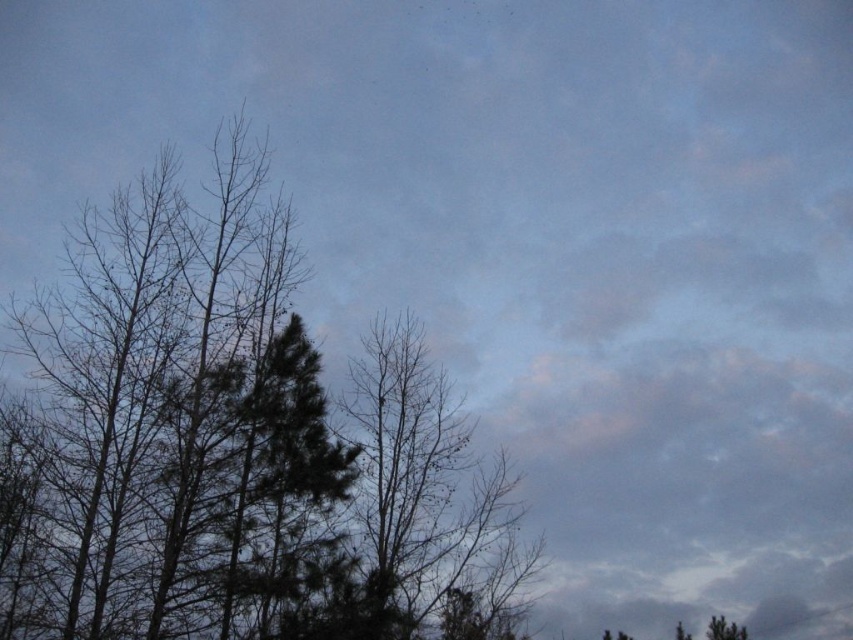
You are an artist trying to paint the scene. You need to decide which area to focus on first based on their sizes. Which object should you start with, the dark green leafy tree at left or the bare branches at center?

The dark green leafy tree at left has a larger width than the bare branches at center, so you should start with the dark green leafy tree at left to capture its broader form first.

In the scene shown: You are standing in the middle of a field and see the dark green leafy tree at left and the bare branches at center. You want to walk to the tree that is closer to you. Which one should you walk towards?

The dark green leafy tree at left is 2.23 meters away from the bare branches at center. Since you are standing in the middle of the field, the bare branches at center are closer to you than the dark green leafy tree at left. Therefore, you should walk towards the bare branches at center.

You are a photographer standing in the middle of the scene. You want to capture a photo that includes both the point at (392, 592) and the point at (440, 380). Since you want the closer point to be in focus, which point should you focus on?

You should focus on point (392, 592) because it is closer to the camera than point (440, 380), so focusing on the closer point will ensure it is in sharp focus while the farther point may appear slightly blurred.